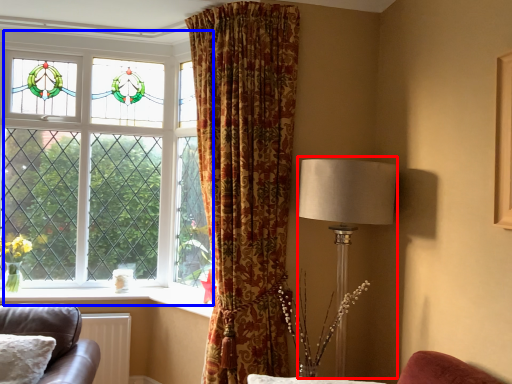
Question: Among these objects, which one is nearest to the camera, table lamp (highlighted by a red box) or window (highlighted by a blue box)?

Choices:
 (A) table lamp
 (B) window

Answer: (A)